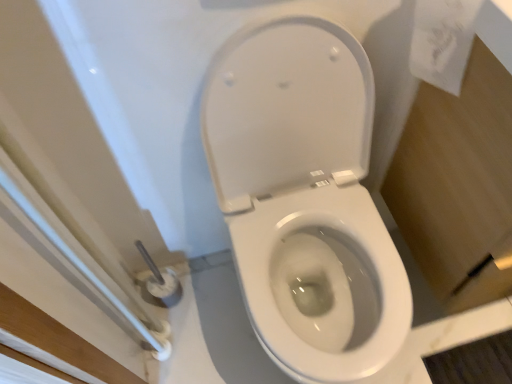
Question: Is white paper towel at upper right inside the boundaries of white glossy toilet at center, or outside?

Choices:
 (A) outside
 (B) inside

Answer: (A)

Question: From the image's perspective, relative to white glossy toilet at center, is white paper towel at upper right above or below?

Choices:
 (A) above
 (B) below

Answer: (A)

Question: In terms of height, does white paper towel at upper right look taller or shorter compared to white glossy toilet at center?

Choices:
 (A) tall
 (B) short

Answer: (B)

Question: Is point (310, 266) positioned closer to the camera than point (436, 11)?

Choices:
 (A) farther
 (B) closer

Answer: (A)

Question: Is white glossy toilet at center spatially inside white paper towel at upper right, or outside of it?

Choices:
 (A) inside
 (B) outside

Answer: (B)

Question: In the image, is white glossy toilet at center positioned in front of or behind white paper towel at upper right?

Choices:
 (A) front
 (B) behind

Answer: (A)

Question: Considering the positions of white glossy toilet at center and white paper towel at upper right in the image, is white glossy toilet at center wider or thinner than white paper towel at upper right?

Choices:
 (A) thin
 (B) wide

Answer: (B)